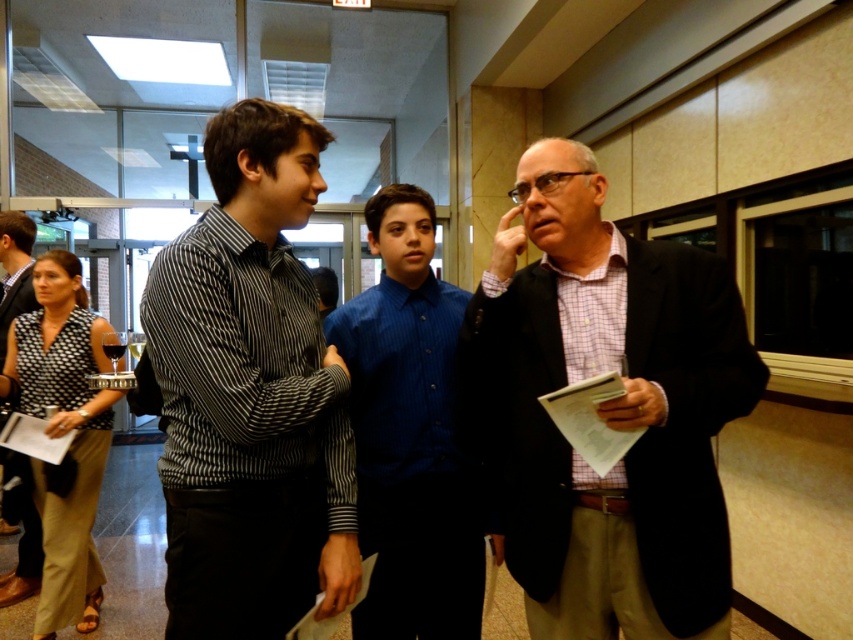
Can you confirm if striped cotton shirt at center is wider than black shirt at left?

Yes.

Which is below, striped cotton shirt at center or black shirt at left?

striped cotton shirt at center is below.

What do you see at coordinates (250, 394) in the screenshot? I see `striped cotton shirt at center` at bounding box center [250, 394].

The width and height of the screenshot is (853, 640). Identify the location of striped cotton shirt at center. (250, 394).

Is plaid fabric shirt at center positioned at the back of striped cotton shirt at center?

Yes, it is.

Is point (724, 378) positioned before point (210, 294)?

No, (724, 378) is further to viewer.

Does point (485, 460) come in front of point (218, 381)?

No, it is not.

Identify the location of plaid fabric shirt at center. (606, 410).

Does blue button-down shirt at center appear on the right side of black shirt at left?

Yes, blue button-down shirt at center is to the right of black shirt at left.

Is the position of blue button-down shirt at center more distant than that of black shirt at left?

No, blue button-down shirt at center is in front of black shirt at left.

Which is in front, point (351, 333) or point (15, 272)?

Point (351, 333) is in front.

Locate an element on the screen. blue button-down shirt at center is located at coordinates (410, 435).